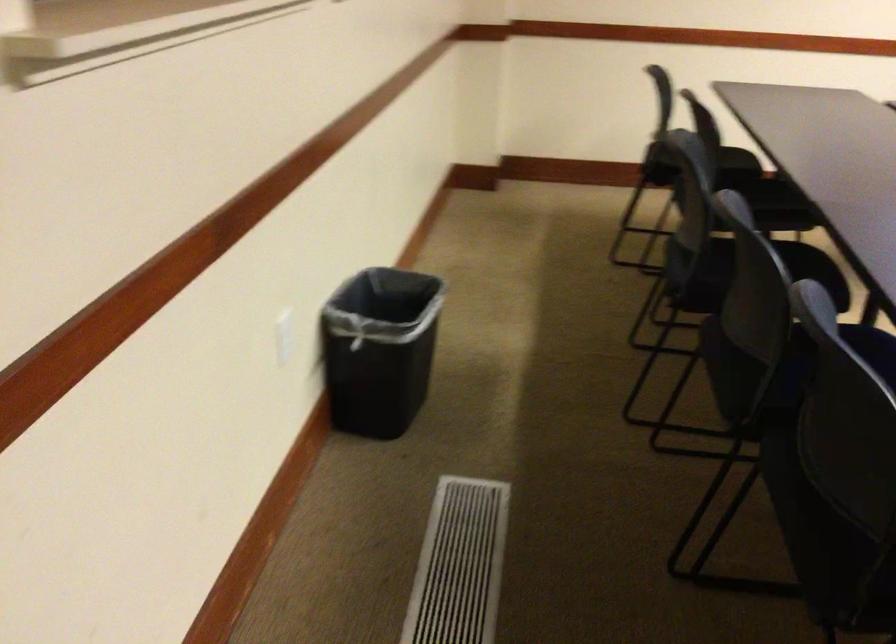
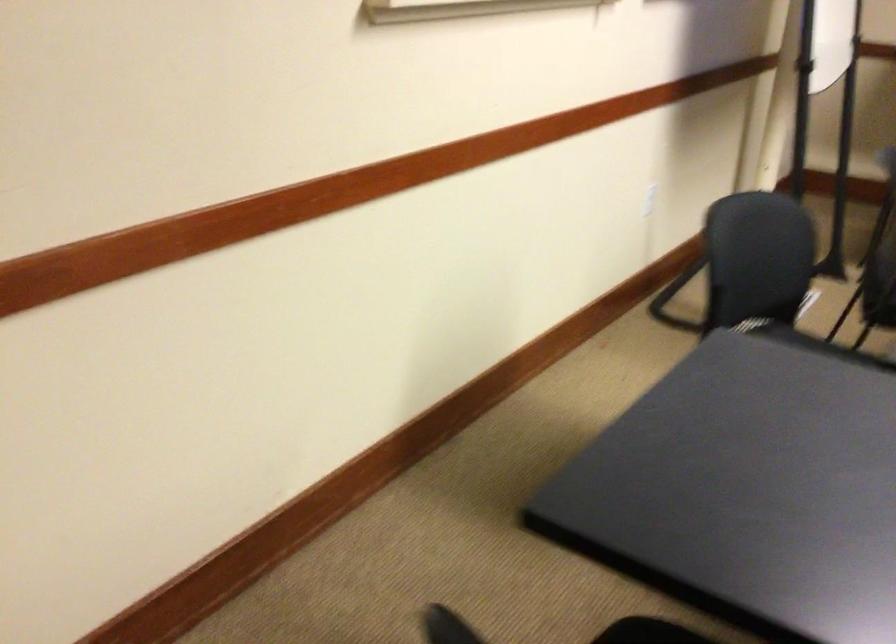
Question: What movement of the cameraman would produce the second image?

Choices:
 (A) Left
 (B) Right
 (C) Forward
 (D) Backward

Answer: (D)